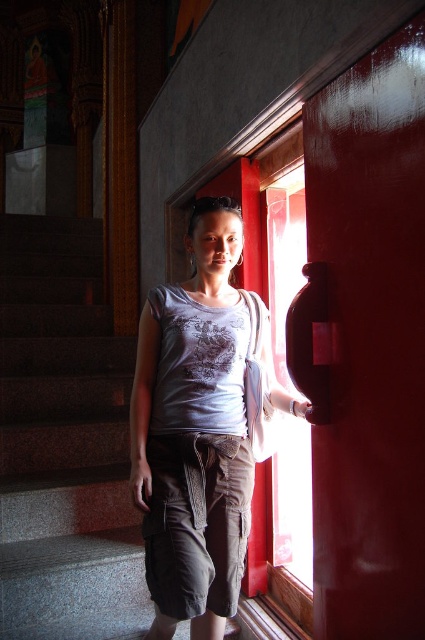
Can you confirm if glossy red door handle at right is smaller than matte gray shirt at center?

Yes.

Is point (320, 230) in front of point (189, 228)?

That is True.

Locate an element on the screen. Image resolution: width=425 pixels, height=640 pixels. glossy red door handle at right is located at coordinates pos(371,340).

Who is lower down, glossy red door handle at right or gray granite stairs at left?

gray granite stairs at left

Is point (314, 211) less distant than point (0, 444)?

Yes, point (314, 211) is closer to viewer.

This screenshot has height=640, width=425. I want to click on glossy red door handle at right, so click(371, 340).

Which is behind, point (95, 493) or point (217, 554)?

The point (95, 493) is more distant.

Is point (16, 483) behind point (146, 349)?

Yes, point (16, 483) is behind point (146, 349).

Find the location of a particular element. The width and height of the screenshot is (425, 640). gray granite stairs at left is located at coordinates (64, 442).